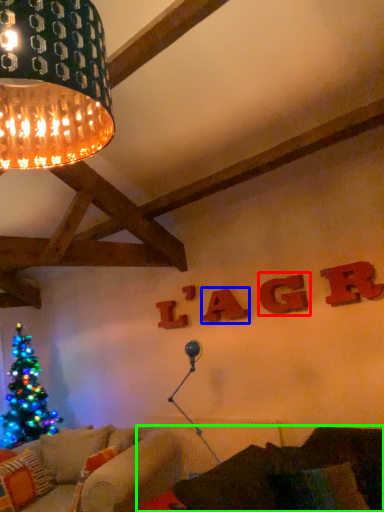
Question: Which is farther away from letter (highlighted by a red box)? letter (highlighted by a blue box) or couch (highlighted by a green box)?

Choices:
 (A) letter
 (B) couch

Answer: (B)